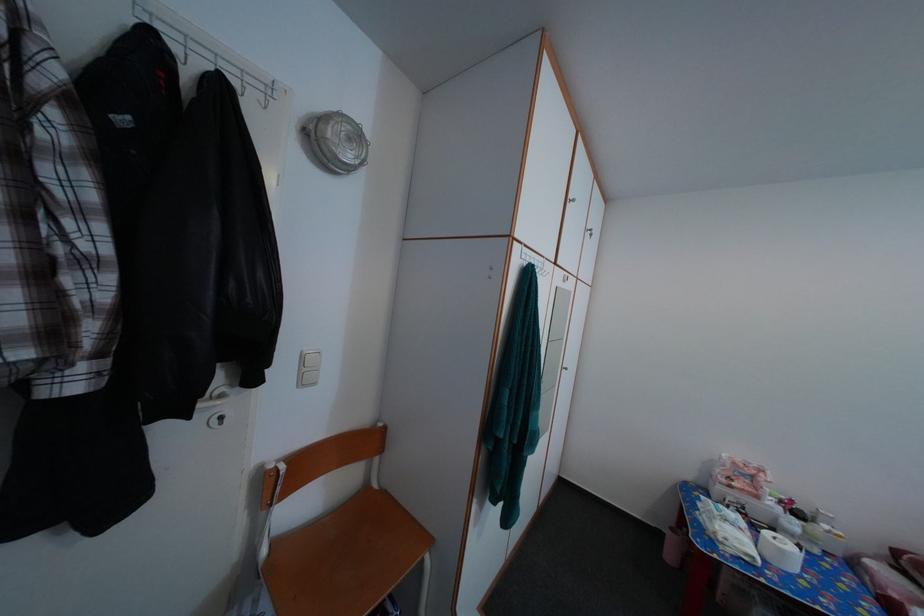
This screenshot has height=616, width=924. I want to click on white door handle, so click(x=213, y=400).